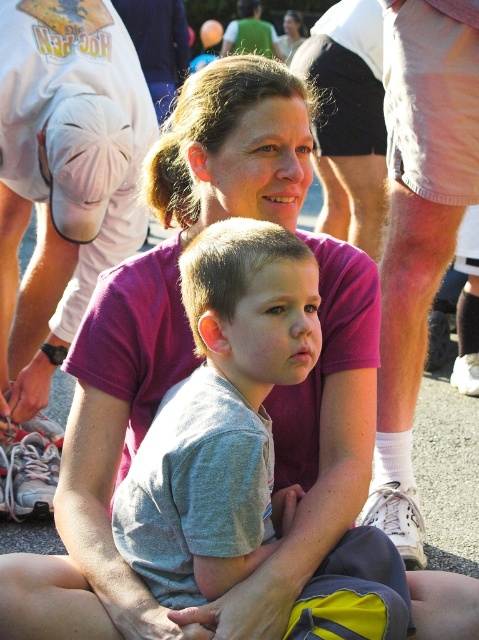
You are a photographer adjusting your camera settings. You notice two points in the image at coordinates point (143,227) and point (466,148). Which point is closer to the camera?

Point (143,227) is further to the camera than point (466,148). Therefore, point (466,148) is closer to the camera.

You are a photographer at the event and want to capture a photo of both the white cotton shirt at center and the white cotton shorts at right in the same frame. Your camera has a minimum focus distance of 1 meter. Can you position yourself so that both are in focus without moving the subjects?

The distance between the white cotton shirt at center and the white cotton shorts at right is 1.06 meters. Since the camera requires a minimum focus distance of 1 meter, positioning yourself appropriately would allow both subjects to be in focus as the distance is just over the required threshold.